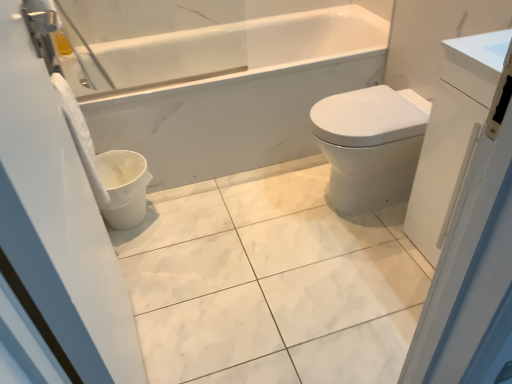
Where is `vacant space in between white glossy screen door at left, which ranks as the first screen door in left-to-right order, and white glossy cabinet at right, which ranks as the second screen door in left-to-right order`? The width and height of the screenshot is (512, 384). vacant space in between white glossy screen door at left, which ranks as the first screen door in left-to-right order, and white glossy cabinet at right, which ranks as the second screen door in left-to-right order is located at coordinates (x=293, y=303).